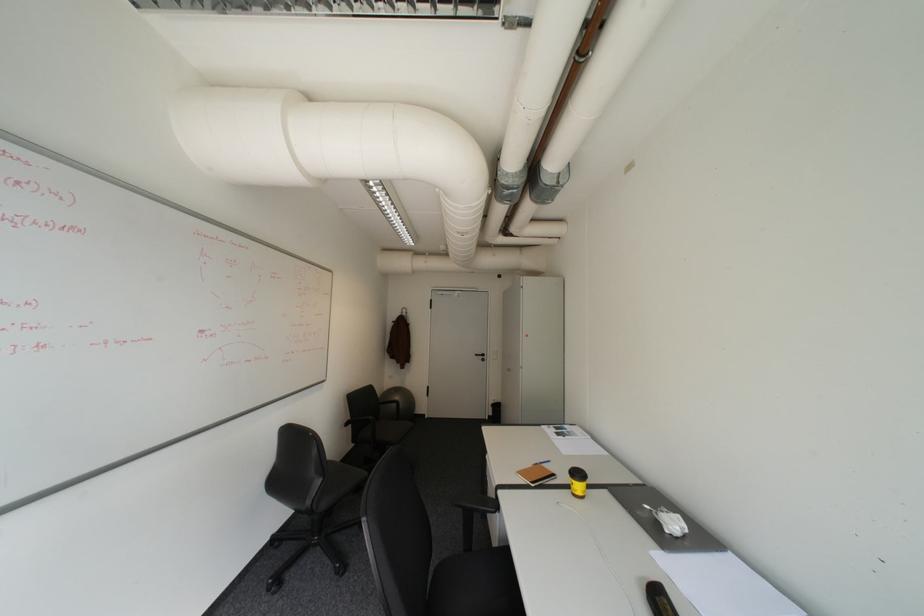
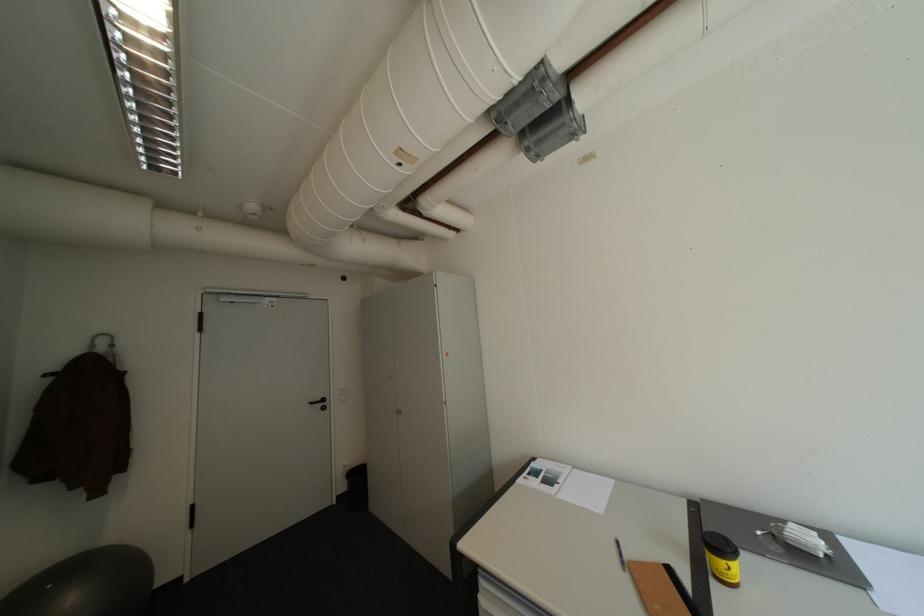
The point at (415, 310) is marked in the first image. Where is the corresponding point in the second image?

(113, 342)